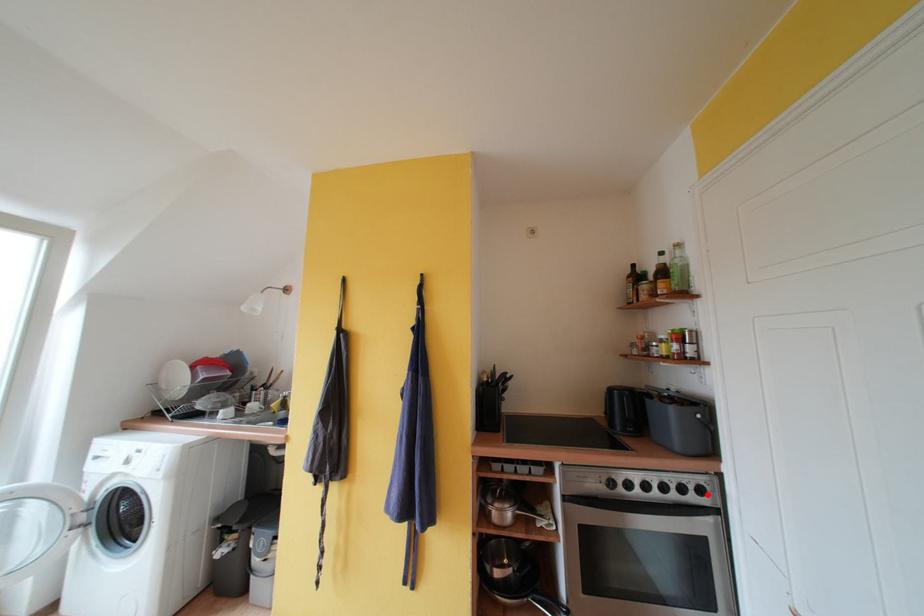
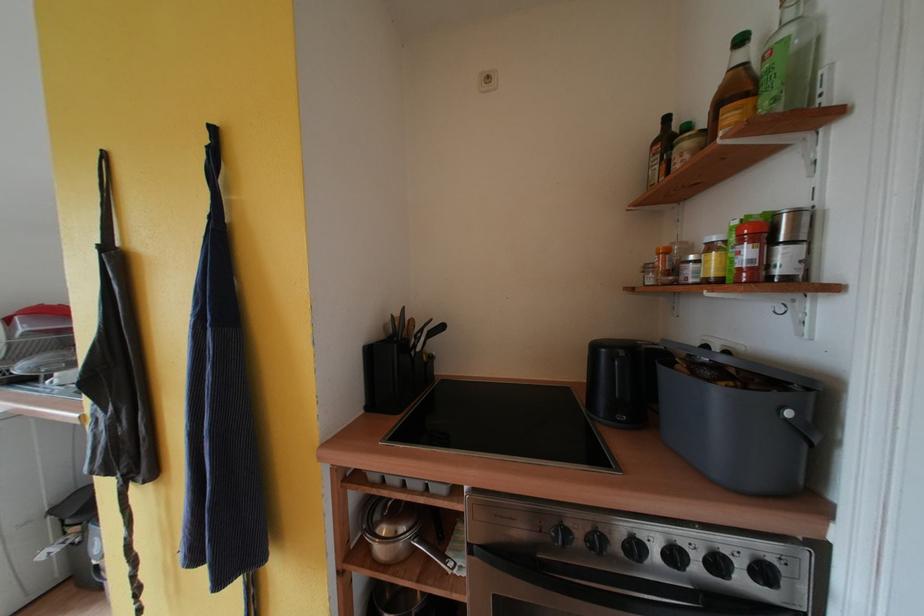
Locate, in the second image, the point that corresponds to the highlighted location in the first image.

(771, 577)